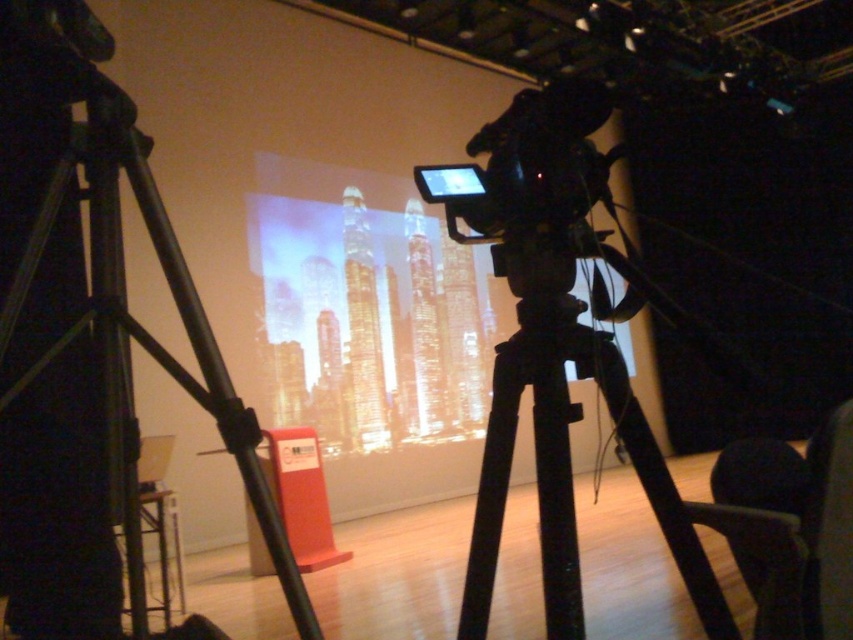
Who is more distant from viewer, (578,605) or (503,161)?

The point (503,161) is more distant.

Does black matte tripod at center lie behind black plastic camera at center?

No, it is in front of black plastic camera at center.

Does point (531, 296) come closer to viewer compared to point (486, 221)?

Yes, point (531, 296) is closer to viewer.

Where is `black matte tripod at center`? This screenshot has height=640, width=853. black matte tripod at center is located at coordinates (566, 451).

Who is lower down, matte glass screen at center or black metal tripod at left?

Positioned lower is black metal tripod at left.

Between matte glass screen at center and black metal tripod at left, which one is positioned higher?

Positioned higher is matte glass screen at center.

What do you see at coordinates (375, 291) in the screenshot? This screenshot has width=853, height=640. I see `matte glass screen at center` at bounding box center [375, 291].

Locate an element on the screen. The image size is (853, 640). matte glass screen at center is located at coordinates (375, 291).

Does black metal tripod at left have a smaller size compared to black plastic camera at center?

Actually, black metal tripod at left might be larger than black plastic camera at center.

Is black metal tripod at left above black plastic camera at center?

No.

Is point (115, 218) positioned behind point (596, 106)?

Yes, it is.

The width and height of the screenshot is (853, 640). What are the coordinates of `black metal tripod at left` in the screenshot? It's located at (132, 317).